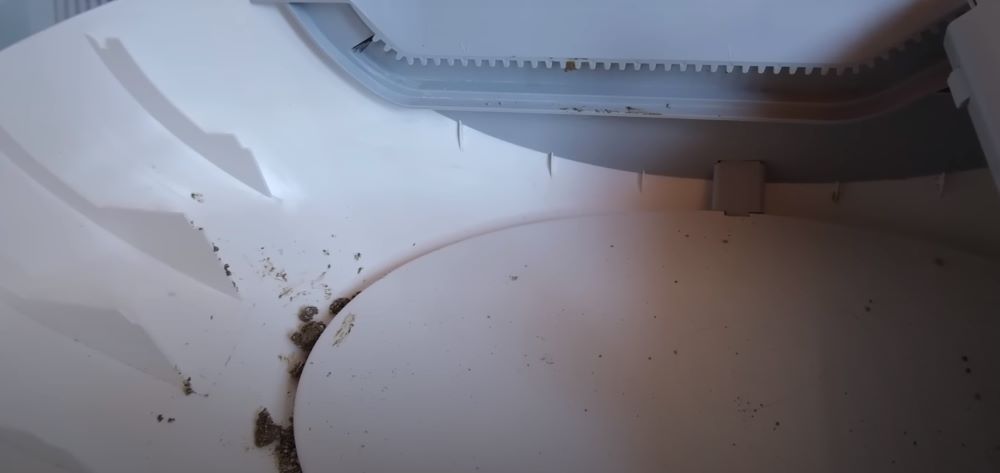
Locate an element on the screen. closest divider barely in view is located at coordinates (8, 456).